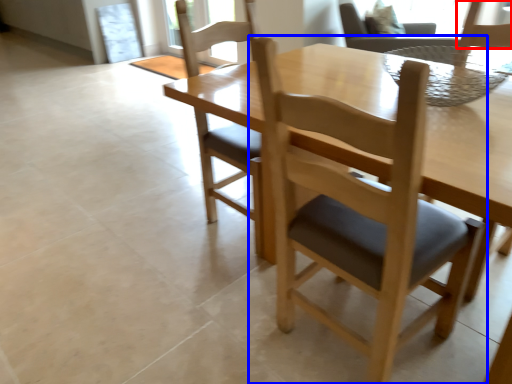
Question: Among these objects, which one is nearest to the camera, chair (highlighted by a red box) or chair (highlighted by a blue box)?

Choices:
 (A) chair
 (B) chair

Answer: (B)